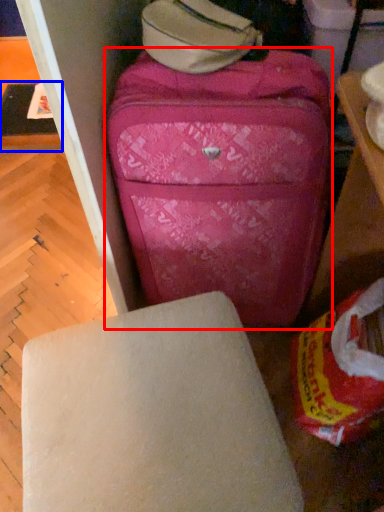
Question: Which object is further to the camera taking this photo, suitcase (highlighted by a red box) or table (highlighted by a blue box)?

Choices:
 (A) suitcase
 (B) table

Answer: (B)